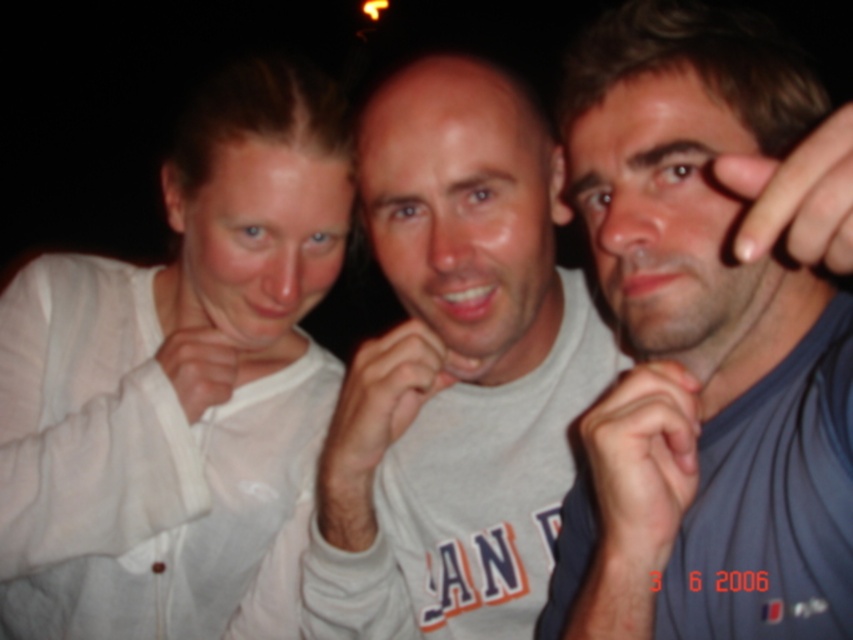
You are a photographer trying to adjust the focus of your camera to capture the white sheer shirt at left clearly. The camera has a focus range of 30 to 40 inches. Will the focus be within range?

The distance of white sheer shirt at left from viewer is 34.58 inches, which falls within the camera focus range of 30 to 40 inches. Therefore, the focus will be within range.

You are a photographer reviewing the image. You notice the dark blue fabric hand at center and the nail polish at upper right. Which object appears larger in the photo?

The dark blue fabric hand at center is taller than nail polish at upper right, so it appears larger in the photo.